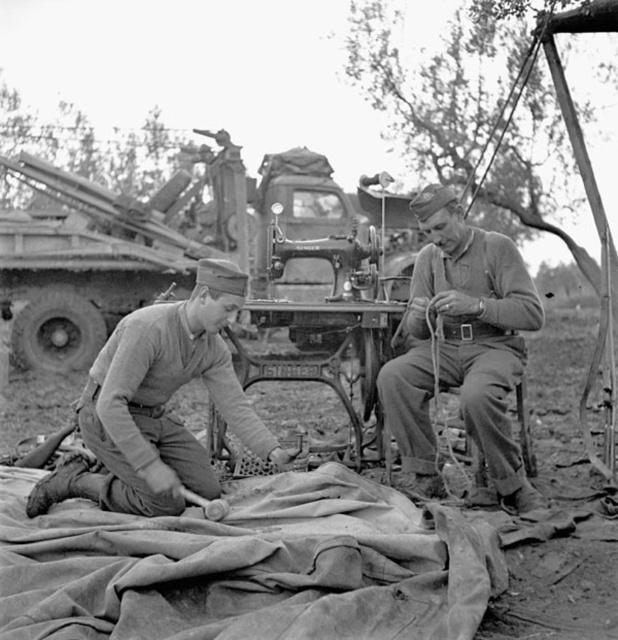
You are a field medic in a military operation. You need to place a medical kit between the rough canvas blanket at lower center and the camouflage fabric at lower left. The medical kit is 22 inches long. Will it fit between them without overlapping?

The rough canvas blanket at lower center is 23.05 inches from camouflage fabric at lower left. Since the medical kit is 22 inches long, it will fit between them without overlapping.

Looking at this image, you are a field medic assessing the available materials in this outdoor workshop. You need to determine if the rough canvas blanket at lower center can cover the matte khaki uniform at center completely. Based on their sizes, is this possible?

The rough canvas blanket at lower center might be wider than matte khaki uniform at center, so there is a possibility that it could cover the uniform completely, but the exact dimensions are uncertain.

Looking at this image, you are a field medic assessing the scene. You notice the rough canvas blanket at lower center and the matte khaki uniform at center. Which object is shorter in height?

The rough canvas blanket at lower center has a lesser height compared to the matte khaki uniform at center, so the rough canvas blanket at lower center is shorter in height.